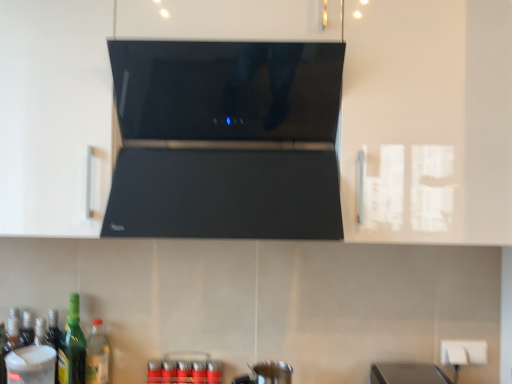
The image size is (512, 384). What do you see at coordinates (31, 365) in the screenshot?
I see `transparent plastic container at lower left, which is the 2th appliance in right-to-left order` at bounding box center [31, 365].

The image size is (512, 384). What do you see at coordinates (184, 369) in the screenshot?
I see `metallic silver can at lower center` at bounding box center [184, 369].

What is the approximate width of white plastic electric outlet at lower right?

It is 1.59 inches.

Locate an element on the screen. The height and width of the screenshot is (384, 512). white plastic electric outlet at lower right is located at coordinates (463, 352).

This screenshot has width=512, height=384. What do you see at coordinates (97, 355) in the screenshot?
I see `green glass bottle at lower left, the 1th bottle viewed from the right` at bounding box center [97, 355].

Where is `transparent plastic container at lower left, which is the 2th appliance in right-to-left order`? The height and width of the screenshot is (384, 512). transparent plastic container at lower left, which is the 2th appliance in right-to-left order is located at coordinates click(x=31, y=365).

Is green glass bottle at lower left, the third bottle from the left, surrounding green glass bottle at lower left, which appears as the second bottle when viewed from the right?

No, green glass bottle at lower left, the third bottle from the left, does not contain green glass bottle at lower left, which appears as the second bottle when viewed from the right.

From a real-world perspective, relative to green glass bottle at lower left, which appears as the second bottle when viewed from the right, is green glass bottle at lower left, the 1th bottle viewed from the right, vertically above or below?

From a real-world perspective, green glass bottle at lower left, the 1th bottle viewed from the right, is physically below green glass bottle at lower left, which appears as the second bottle when viewed from the right.

From the image's perspective, would you say green glass bottle at lower left, the 1th bottle viewed from the right, is shown under green glass bottle at lower left, placed as the second bottle when sorted from left to right?

Correct, green glass bottle at lower left, the 1th bottle viewed from the right, appears lower than green glass bottle at lower left, placed as the second bottle when sorted from left to right, in the image.

From the image's perspective, count 2nd bottles upward from the green glass bottle at lower left, the third bottle from the left, and point to it. Please provide its 2D coordinates.

[(72, 348)]

Looking at their sizes, would you say black glossy range hood at center is wider or thinner than green glass bottle at lower left, which appears as the second bottle when viewed from the right?

black glossy range hood at center is wider than green glass bottle at lower left, which appears as the second bottle when viewed from the right.

Is black glossy range hood at center located outside green glass bottle at lower left, placed as the second bottle when sorted from left to right?

Yes.

From the image's perspective, count 1st bottles downward from the black glossy range hood at center and point to it. Please provide its 2D coordinates.

[(72, 348)]

Does point (215, 127) come in front of point (75, 339)?

Yes, point (215, 127) is closer to viewer.

Measure the distance from white plastic electric outlet at lower right to metallic silver can at lower center.

white plastic electric outlet at lower right is 84.02 centimeters from metallic silver can at lower center.

Identify the location of electric outlet behind the metallic silver can at lower center. This screenshot has width=512, height=384. (463, 352).

Is white plastic electric outlet at lower right facing away from metallic silver can at lower center?

No, white plastic electric outlet at lower right's orientation is not away from metallic silver can at lower center.

Can you confirm if white plastic electric outlet at lower right is taller than metallic silver can at lower center?

In fact, white plastic electric outlet at lower right may be shorter than metallic silver can at lower center.

Between transparent plastic container at lower left, which is the 2th appliance in right-to-left order, and green glass bottle at lower left, which ranks as the third bottle in right-to-left order, which one appears on the left side from the viewer's perspective?

green glass bottle at lower left, which ranks as the third bottle in right-to-left order, is more to the left.

Locate an element on the screen. appliance that is the 1st object located below the green glass bottle at lower left, which ranks as the third bottle in right-to-left order (from the image's perspective) is located at coordinates (31, 365).

Is transparent plastic container at lower left, the first appliance positioned from the left, not near green glass bottle at lower left, the first bottle in the left-to-right sequence?

They are positioned close to each other.

In the scene shown: From a real-world perspective, which is physically below, green glass bottle at lower left, placed as the second bottle when sorted from left to right, or white plastic electric outlet at lower right?

white plastic electric outlet at lower right is physically lower.

How different are the orientations of green glass bottle at lower left, placed as the second bottle when sorted from left to right, and white plastic electric outlet at lower right in degrees?

They differ by 0.159 degrees in their facing directions.

In terms of width, does green glass bottle at lower left, which appears as the second bottle when viewed from the right, look wider or thinner when compared to white plastic electric outlet at lower right?

In the image, green glass bottle at lower left, which appears as the second bottle when viewed from the right, appears to be wider than white plastic electric outlet at lower right.

Considering the points (75, 353) and (476, 352), which point is behind, point (75, 353) or point (476, 352)?

The point (476, 352) is farther.

Which object is positioned more to the left, matte black range hood at center or green glass bottle at lower left, the third bottle from the left?

green glass bottle at lower left, the third bottle from the left.

From the image's perspective, is matte black range hood at center above or below green glass bottle at lower left, the third bottle from the left?

matte black range hood at center is situated higher than green glass bottle at lower left, the third bottle from the left, in the image.

Between matte black range hood at center and green glass bottle at lower left, the third bottle from the left, which one has less height?

green glass bottle at lower left, the third bottle from the left, is shorter.

From the picture: Is white plastic electric outlet at lower right beside green glass bottle at lower left, the 1th bottle viewed from the right?

There is a gap between white plastic electric outlet at lower right and green glass bottle at lower left, the 1th bottle viewed from the right.

From a real-world perspective, is white plastic electric outlet at lower right beneath green glass bottle at lower left, the third bottle from the left?

Incorrect, from a real-world perspective, white plastic electric outlet at lower right is higher than green glass bottle at lower left, the third bottle from the left.

In terms of width, does white plastic electric outlet at lower right look wider or thinner when compared to green glass bottle at lower left, the third bottle from the left?

white plastic electric outlet at lower right is thinner than green glass bottle at lower left, the third bottle from the left.

Identify the location of electric outlet located behind the green glass bottle at lower left, the third bottle from the left. Image resolution: width=512 pixels, height=384 pixels. (463, 352).

There is a green glass bottle at lower left, which appears as the second bottle when viewed from the right. Where is `the 2nd bottle below it (from a real-world perspective)`? the 2nd bottle below it (from a real-world perspective) is located at coordinates (97, 355).

I want to click on home appliance above the green glass bottle at lower left, placed as the second bottle when sorted from left to right (from a real-world perspective), so click(226, 140).

Estimate the real-world distances between objects in this image. Which object is closer to green glass bottle at lower left, the third bottle from the left, green glass bottle at lower left, which ranks as the third bottle in right-to-left order, or black glossy range hood at center?

green glass bottle at lower left, which ranks as the third bottle in right-to-left order, lies closer to green glass bottle at lower left, the third bottle from the left, than the other object.

Based on their spatial positions, is green glass bottle at lower left, which appears as the second bottle when viewed from the right, or matte black range hood at center further from transparent plastic container at lower left, the first appliance positioned from the left?

matte black range hood at center.

Based on the photo, which object lies further to the anchor point green glass bottle at lower left, the 1th bottle viewed from the right, metallic silver pot at lower center, which ranks as the second appliance in left-to-right order, or matte black range hood at center?

matte black range hood at center.

In the scene shown: Based on their spatial positions, is metallic silver pot at lower center, which ranks as the second appliance in left-to-right order, or green glass bottle at lower left, the first bottle in the left-to-right sequence, further from green glass bottle at lower left, placed as the second bottle when sorted from left to right?

Based on the image, metallic silver pot at lower center, which ranks as the second appliance in left-to-right order, appears to be further to green glass bottle at lower left, placed as the second bottle when sorted from left to right.

Based on their spatial positions, is metallic silver can at lower center or green glass bottle at lower left, the third bottle from the left, closer to matte black range hood at center?

metallic silver can at lower center.

Estimate the real-world distances between objects in this image. Which object is closer to green glass bottle at lower left, the first bottle in the left-to-right sequence, green glass bottle at lower left, which appears as the second bottle when viewed from the right, or metallic silver pot at lower center, which ranks as the second appliance in left-to-right order?

Based on the image, green glass bottle at lower left, which appears as the second bottle when viewed from the right, appears to be nearer to green glass bottle at lower left, the first bottle in the left-to-right sequence.

Which object lies nearer to the anchor point transparent plastic container at lower left, which is the 2th appliance in right-to-left order, green glass bottle at lower left, which appears as the second bottle when viewed from the right, or green glass bottle at lower left, the third bottle from the left?

Among the two, green glass bottle at lower left, which appears as the second bottle when viewed from the right, is located nearer to transparent plastic container at lower left, which is the 2th appliance in right-to-left order.

Which object lies nearer to the anchor point transparent plastic container at lower left, the first appliance positioned from the left, green glass bottle at lower left, the first bottle in the left-to-right sequence, or black glossy range hood at center?

The object closer to transparent plastic container at lower left, the first appliance positioned from the left, is green glass bottle at lower left, the first bottle in the left-to-right sequence.

At what (x,y) coordinates should I click in order to perform the action: click on home appliance that lies between matte black range hood at center and metallic silver can at lower center from top to bottom. Please return your answer as a coordinate pair (x, y). Image resolution: width=512 pixels, height=384 pixels. Looking at the image, I should click on (226, 140).

Locate an element on the screen. The height and width of the screenshot is (384, 512). appliance between black glossy range hood at center and metallic silver pot at lower center, which ranks as the second appliance in left-to-right order, in the up-down direction is located at coordinates (31, 365).

Find the location of `bottle located between green glass bottle at lower left, placed as the second bottle when sorted from left to right, and metallic silver can at lower center in the left-right direction`. bottle located between green glass bottle at lower left, placed as the second bottle when sorted from left to right, and metallic silver can at lower center in the left-right direction is located at coordinates (97, 355).

Locate an element on the screen. The height and width of the screenshot is (384, 512). appliance situated between metallic silver can at lower center and white plastic electric outlet at lower right from left to right is located at coordinates (266, 373).